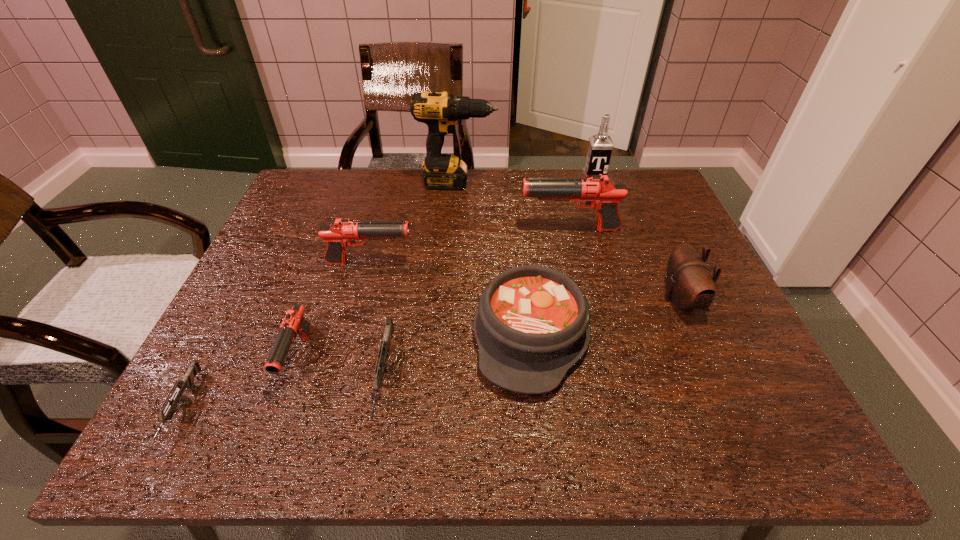
The height and width of the screenshot is (540, 960). What are the coordinates of `the tallest object` in the screenshot? It's located at (440, 111).

The height and width of the screenshot is (540, 960). I want to click on black drill, so click(x=440, y=111).

I want to click on the eighth shortest object, so click(x=600, y=147).

You are a GUI agent. You are given a task and a screenshot of the screen. Output one action in this format:
    pyautogui.click(x=<x>, y=<y>)
    Task: Click on the rightmost gun
    The width and height of the screenshot is (960, 540).
    Given the screenshot: What is the action you would take?
    pyautogui.click(x=599, y=191)

Locate an element on the screen. This screenshot has width=960, height=540. the biggest black gun is located at coordinates (599, 191).

Locate an element on the screen. The height and width of the screenshot is (540, 960). the second farthest black gun is located at coordinates (341, 233).

This screenshot has height=540, width=960. Identify the location of the fourth farthest object. click(x=341, y=233).

Find the location of `brown pouch`. brown pouch is located at coordinates (690, 284).

I want to click on pouch, so click(690, 284).

The height and width of the screenshot is (540, 960). I want to click on gray casserole, so click(532, 326).